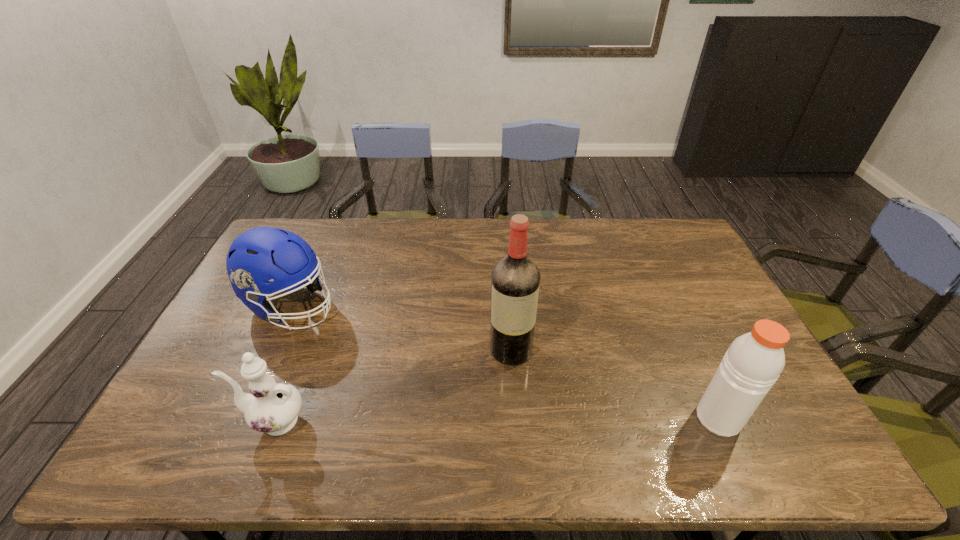
Identify the location of chinaware. The height and width of the screenshot is (540, 960). (272, 407).

I want to click on shaker, so click(x=753, y=362).

Image resolution: width=960 pixels, height=540 pixels. I want to click on the tallest object, so click(515, 280).

This screenshot has width=960, height=540. I want to click on the second object from right to left, so click(x=515, y=280).

You are a GUI agent. You are given a task and a screenshot of the screen. Output one action in this format:
    pyautogui.click(x=<x>, y=<y>)
    Task: Click on the football helmet
    The width and height of the screenshot is (960, 540).
    Given the screenshot: What is the action you would take?
    pyautogui.click(x=260, y=254)

Where is `vacant space situated at the spout of the chinaware`? vacant space situated at the spout of the chinaware is located at coordinates (168, 421).

You are a GUI agent. You are given a task and a screenshot of the screen. Output one action in this format:
    pyautogui.click(x=<x>, y=<y>)
    Task: Click on the vacant space located at the spout of the chinaware
    The image size is (960, 540).
    Given the screenshot: What is the action you would take?
    pyautogui.click(x=168, y=421)

You are a GUI agent. You are given a task and a screenshot of the screen. Output one action in this format:
    pyautogui.click(x=<x>, y=<y>)
    Task: Click on the vacant region located at the spout of the chinaware
    
    Given the screenshot: What is the action you would take?
    pyautogui.click(x=201, y=421)

The image size is (960, 540). Identify the location of free space located on the back of the rightmost object. coord(678,330).

Where is `free space located 0.070m on the front-facing side of the tallest object`? The width and height of the screenshot is (960, 540). free space located 0.070m on the front-facing side of the tallest object is located at coordinates (514, 389).